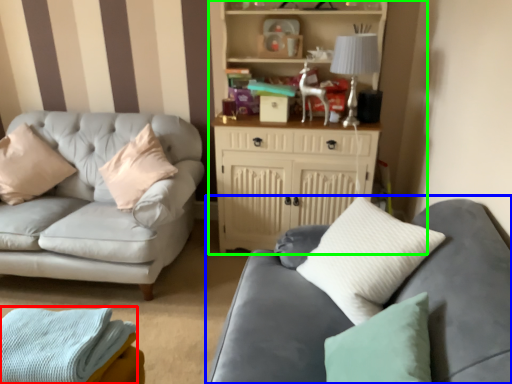
Question: Estimate the real-world distances between objects in this image. Which object is closer to material (highlighted by a red box), studio couch (highlighted by a blue box) or entertainment center (highlighted by a green box)?

Choices:
 (A) studio couch
 (B) entertainment center

Answer: (A)